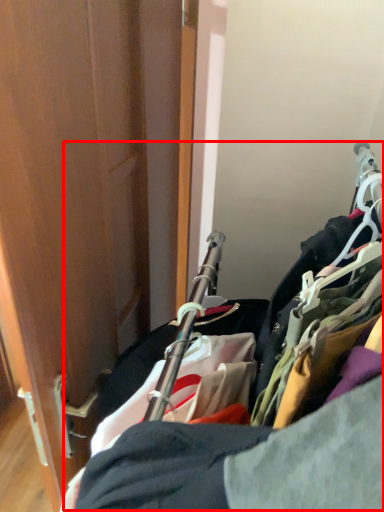
Question: From the image's perspective, what is the correct spatial relationship of closet (annotated by the red box) in relation to door?

Choices:
 (A) above
 (B) below

Answer: (B)